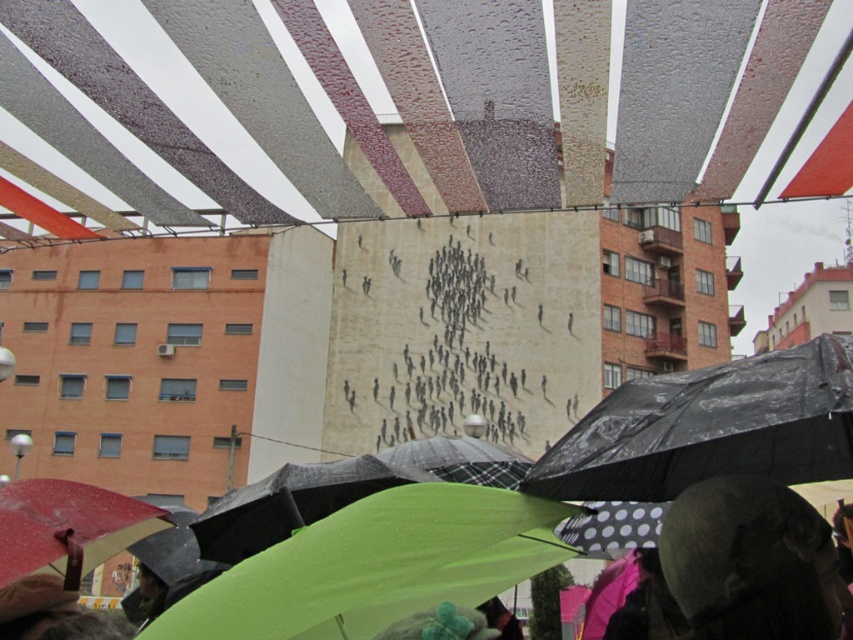
You are standing at the point with coordinates [711,428] in the image. What object are you standing on?

You are standing on the black plastic umbrella at center, as the point coordinates [711,428] correspond to its location.

Looking at this image, you are a pedestrian trying to stay dry while walking through the rain. You notice a black plastic umbrella at center and a textured fabric canopy at center. Which object should you approach to stay dry?

The black plastic umbrella at center is in front of the textured fabric canopy at center, so approaching the black plastic umbrella at center would provide better shelter from the rain.